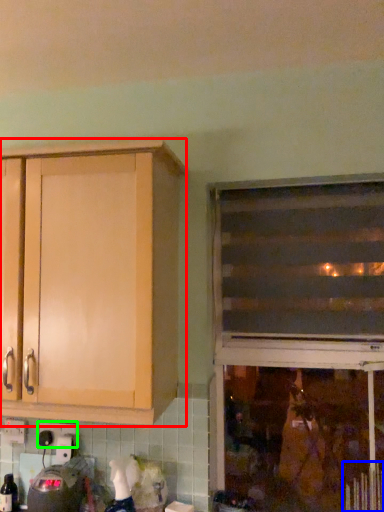
Question: Estimate the real-world distances between objects in this image. Which object is closer to cabinetry (highlighted by a red box), radiator (highlighted by a blue box) or electric outlet (highlighted by a green box)?

Choices:
 (A) radiator
 (B) electric outlet

Answer: (B)